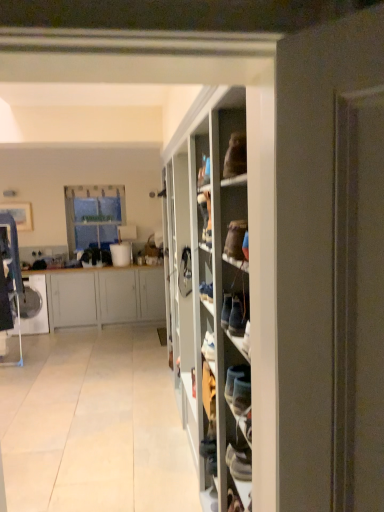
What do you see at coordinates (185, 272) in the screenshot? I see `white fabric shoe at center` at bounding box center [185, 272].

Find the location of `white glossy washing machine at left`. white glossy washing machine at left is located at coordinates (39, 311).

This screenshot has height=512, width=384. What are the coordinates of `white tile floor at center` in the screenshot? It's located at (94, 426).

In the image, is white fabric shoe at center positioned in front of or behind white glossy washing machine at left?

In the image, white fabric shoe at center appears in front of white glossy washing machine at left.

From the image's perspective, relative to white glossy washing machine at left, is white fabric shoe at center above or below?

white fabric shoe at center is situated higher than white glossy washing machine at left in the image.

Do you think white fabric shoe at center is within white glossy washing machine at left, or outside of it?

The correct answer is: outside.

Between white tile floor at center and white glossy washing machine at left, which one appears on the right side from the viewer's perspective?

Positioned to the right is white tile floor at center.

Is white tile floor at center shorter than white glossy washing machine at left?

Yes.

From a real-world perspective, is white tile floor at center physically located above or below white glossy washing machine at left?

In terms of real-world spatial position, white tile floor at center is below white glossy washing machine at left.

In the scene shown: Is white matte cabinet at left at the back of white fabric shoe at center?

No, white fabric shoe at center's orientation is not away from white matte cabinet at left.

Can you confirm if white fabric shoe at center is thinner than white matte cabinet at left?

Yes.

From a real-world perspective, which object rests below the other?

In real-world perspective, white matte cabinet at left is lower.

Find the location of a particular element. Image resolution: width=384 pixels, height=512 pixels. shoe above the white matte cabinet at left (from the image's perspective) is located at coordinates (185, 272).

Identify the location of cabinetry that is above the white glossy washing machine at left (from a real-world perspective). (105, 296).

Between white glossy washing machine at left and white matte cabinet at left, which one appears on the left side from the viewer's perspective?

Positioned to the left is white glossy washing machine at left.

From a real-world perspective, is white glossy washing machine at left on white matte cabinet at left?

Actually, white glossy washing machine at left is physically below white matte cabinet at left in the real world.

How different are the orientations of clear glass window at upper left and white matte cabinet at left in degrees?

There is a 0.31-degree angle between the facing directions of clear glass window at upper left and white matte cabinet at left.

In the image, is clear glass window at upper left on the left side or the right side of white matte cabinet at left?

From the image, it's evident that clear glass window at upper left is to the right of white matte cabinet at left.

Is white matte cabinet at left a part of clear glass window at upper left?

No, white matte cabinet at left is not a part of clear glass window at upper left.

Which is less distant, (108,243) or (104,322)?

Point (108,243) is positioned farther from the camera compared to point (104,322).

Is white matte cabinet at left positioned with its back to clear glass window at upper left?

white matte cabinet at left does not have its back to clear glass window at upper left.

From the image's perspective, between white matte cabinet at left and clear glass window at upper left, who is located below?

From the image's view, white matte cabinet at left is below.

Considering the relative sizes of white matte cabinet at left and clear glass window at upper left in the image provided, is white matte cabinet at left bigger than clear glass window at upper left?

Yes, white matte cabinet at left is bigger than clear glass window at upper left.

Considering the relative sizes of white tile floor at center and white matte cabinet at left in the image provided, is white tile floor at center bigger than white matte cabinet at left?

Actually, white tile floor at center might be smaller than white matte cabinet at left.

Who is more distant, white tile floor at center or white matte cabinet at left?

Positioned behind is white matte cabinet at left.

Can we say white tile floor at center lies outside white matte cabinet at left?

Yes, white tile floor at center is not within white matte cabinet at left.

Looking at this image, is white tile floor at center next to white matte cabinet at left?

No, white tile floor at center is not in contact with white matte cabinet at left.

Where is `shoe located above the white glossy washing machine at left (from a real-world perspective)`? shoe located above the white glossy washing machine at left (from a real-world perspective) is located at coordinates (185, 272).

Locate an element on the screen. Image resolution: width=384 pixels, height=512 pixels. corridor below the white glossy washing machine at left (from the image's perspective) is located at coordinates (94, 426).

Which object lies nearer to the anchor point white glossy washing machine at left, white fabric shoe at center or clear glass window at upper left?

clear glass window at upper left is closer to white glossy washing machine at left.

Considering their positions, is clear glass window at upper left positioned closer to white matte cabinet at left than white tile floor at center?

The object closer to white matte cabinet at left is clear glass window at upper left.

Based on their spatial positions, is white tile floor at center or white matte cabinet at left closer to clear glass window at upper left?

white matte cabinet at left lies closer to clear glass window at upper left than the other object.

Based on the photo, based on their spatial positions, is white matte cabinet at left or clear glass window at upper left further from white fabric shoe at center?

The object further to white fabric shoe at center is clear glass window at upper left.

From the picture: From the image, which object appears to be nearer to white glossy washing machine at left, white tile floor at center or white matte cabinet at left?

white matte cabinet at left lies closer to white glossy washing machine at left than the other object.

Considering their positions, is white matte cabinet at left positioned further to white fabric shoe at center than white tile floor at center?

white matte cabinet at left is positioned further to the anchor white fabric shoe at center.

Looking at the image, which one is located closer to white glossy washing machine at left, white matte cabinet at left or white tile floor at center?

white matte cabinet at left is closer to white glossy washing machine at left.

Considering their positions, is white tile floor at center positioned further to clear glass window at upper left than white glossy washing machine at left?

white tile floor at center is positioned further to the anchor clear glass window at upper left.

At what (x,y) coordinates should I click in order to perform the action: click on washing machine located between white fabric shoe at center and clear glass window at upper left in the depth direction. Please return your answer as a coordinate pair (x, y). The height and width of the screenshot is (512, 384). Looking at the image, I should click on (39, 311).

Identify the location of cabinetry between white fabric shoe at center and white glossy washing machine at left along the z-axis. This screenshot has height=512, width=384. (105, 296).

Locate an element on the screen. The width and height of the screenshot is (384, 512). shoe located between white tile floor at center and clear glass window at upper left in the depth direction is located at coordinates (185, 272).

Where is `shoe between white tile floor at center and white matte cabinet at left in the front-back direction`? shoe between white tile floor at center and white matte cabinet at left in the front-back direction is located at coordinates (185, 272).